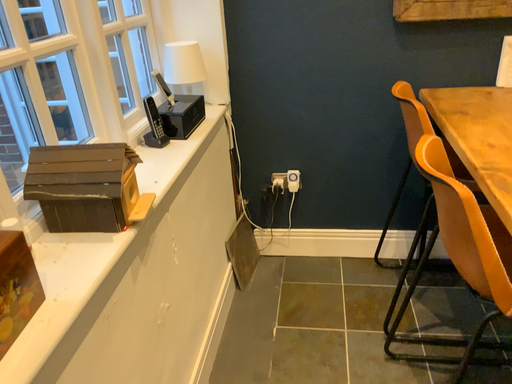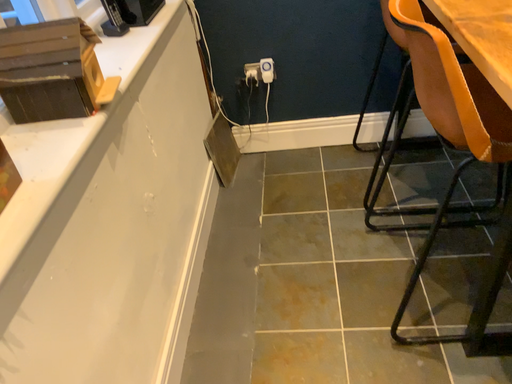
Question: Which way did the camera rotate in the video?

Choices:
 (A) rotated downward
 (B) rotated upward

Answer: (A)